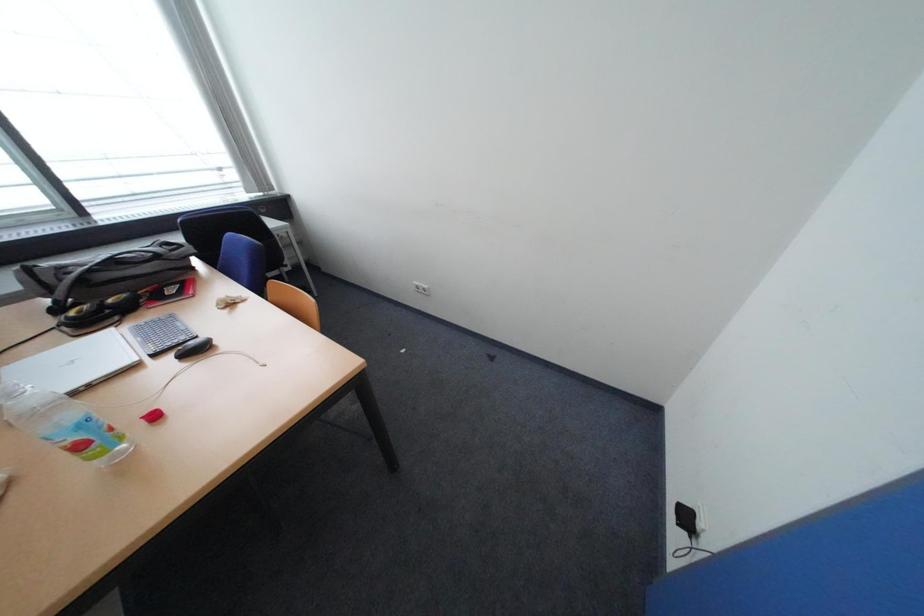
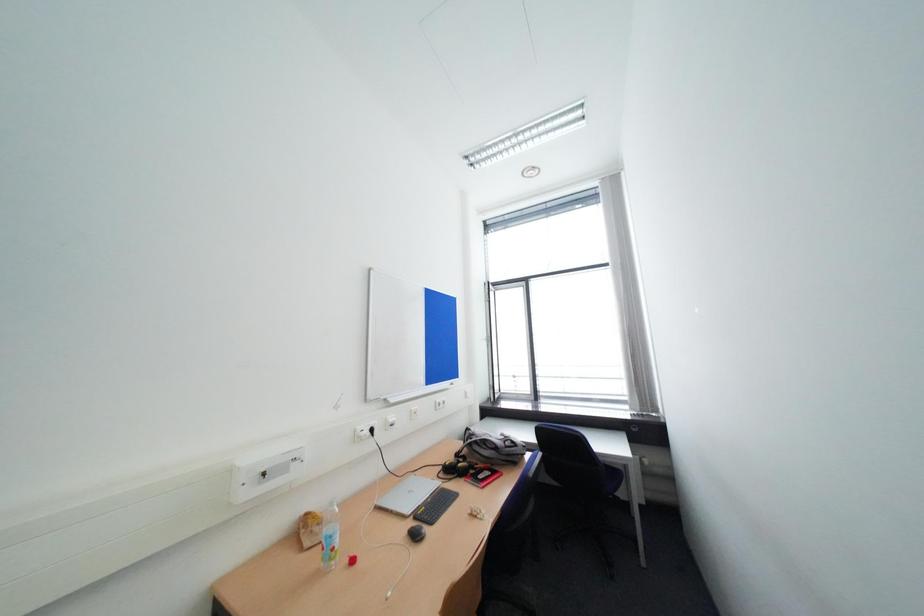
Question: How did the camera likely rotate?

Choices:
 (A) Left
 (B) Right
 (C) Up
 (D) Down

Answer: (A)